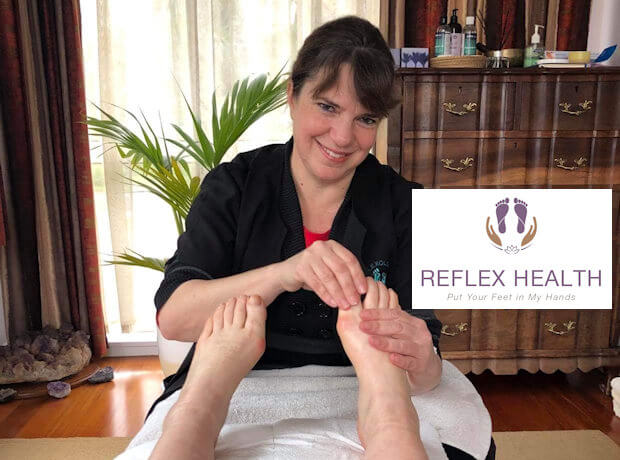
Find the location of a particular element. Image resolution: width=620 pixels, height=460 pixels. wooden board is located at coordinates (428, 21).